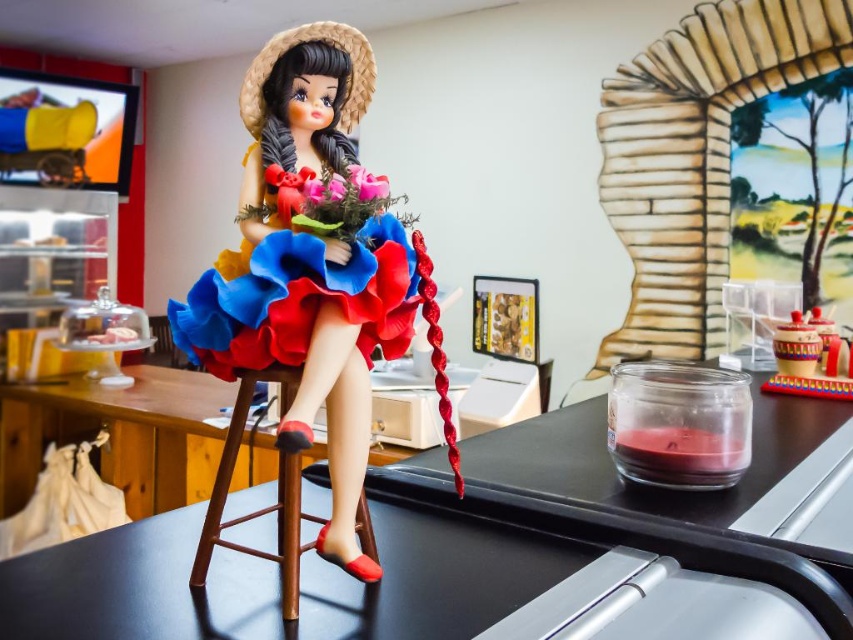
Does point (376, 182) come closer to viewer compared to point (331, 180)?

That is False.

Is the position of matte pink fabric flower at center more distant than that of matte plastic flower at center?

Yes, matte pink fabric flower at center is further from the viewer.

Measure the distance between matte pink fabric flower at center and camera.

matte pink fabric flower at center and camera are 19.18 inches apart.

You are a GUI agent. You are given a task and a screenshot of the screen. Output one action in this format:
    pyautogui.click(x=<x>, y=<y>)
    Task: Click on the matte pink fabric flower at center
    This screenshot has height=640, width=853.
    Given the screenshot: What is the action you would take?
    pyautogui.click(x=367, y=182)

Is point (363, 102) farther from camera compared to point (335, 196)?

That is True.

Is matte plastic doll at center behind matte plastic flower at center?

No, it is in front of matte plastic flower at center.

Locate an element on the screen. The width and height of the screenshot is (853, 640). matte plastic doll at center is located at coordinates (306, 266).

This screenshot has width=853, height=640. I want to click on matte plastic doll at center, so click(306, 266).

Is wooden bar stool at center above matte plastic flower at center?

Incorrect, wooden bar stool at center is not positioned above matte plastic flower at center.

Between wooden bar stool at center and matte plastic flower at center, which one has less height?

matte plastic flower at center is shorter.

At what (x,y) coordinates should I click in order to perform the action: click on wooden bar stool at center. Please return your answer as a coordinate pair (x, y). The image size is (853, 640). Looking at the image, I should click on (265, 506).